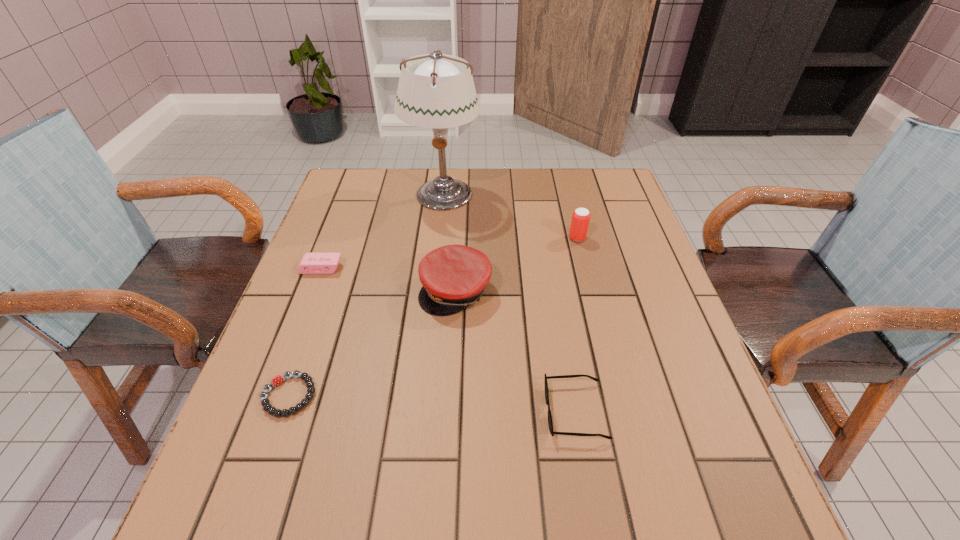
This screenshot has width=960, height=540. Identify the location of free space at the far edge of the desktop. (488, 193).

In order to click on vacant region at the near edge of the desktop in this screenshot , I will do `click(616, 490)`.

Locate an element on the screen. The width and height of the screenshot is (960, 540). free region at the left edge of the desktop is located at coordinates (240, 457).

You are a GUI agent. You are given a task and a screenshot of the screen. Output one action in this format:
    pyautogui.click(x=<x>, y=<y>)
    Task: Click on the free space at the right edge of the desktop
    This screenshot has width=960, height=540.
    Given the screenshot: What is the action you would take?
    pyautogui.click(x=624, y=248)

Find the location of `vacant space at the far left corner of the desktop`. vacant space at the far left corner of the desktop is located at coordinates (360, 196).

Identify the location of free location at the far right corner of the desktop. (620, 201).

You are a GUI agent. You are given a task and a screenshot of the screen. Output one action in this format:
    pyautogui.click(x=<x>, y=<y>)
    Task: Click on the vacant position at the near right corner of the desktop
    The width and height of the screenshot is (960, 540).
    Given the screenshot: What is the action you would take?
    pyautogui.click(x=674, y=533)

I want to click on empty space between the cap and the farthest object, so (x=449, y=242).

Where is `vacant space in between the second object from right to left and the shortest object`? This screenshot has height=540, width=960. vacant space in between the second object from right to left and the shortest object is located at coordinates (432, 403).

Where is `vacant area that lies between the farthest object and the sunglasses`? This screenshot has width=960, height=540. vacant area that lies between the farthest object and the sunglasses is located at coordinates (509, 303).